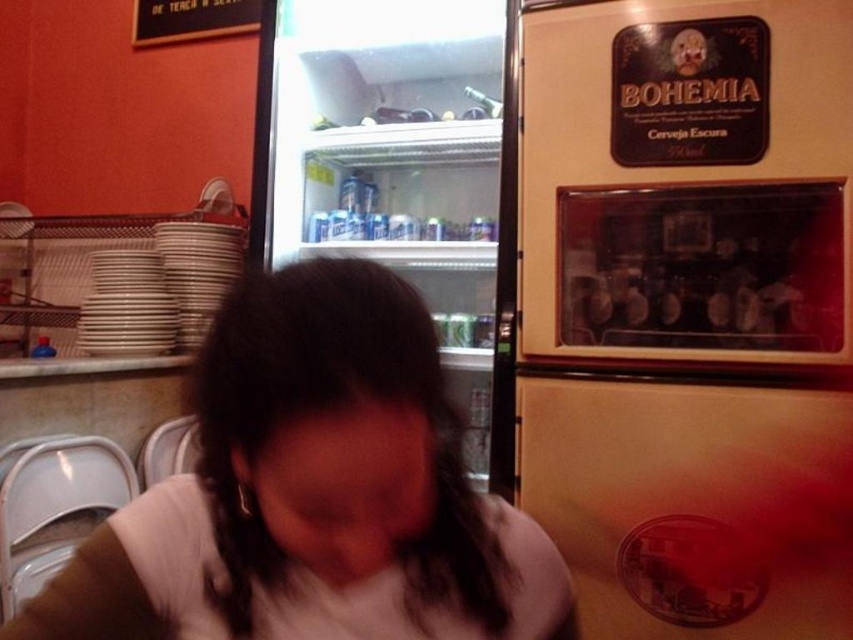
You are a customer in the eatery and want to ask the staff member wearing the white matte shirt at center about the drinks available. Where should you look to find them?

The white matte shirt at center is located at point (x=314, y=492), so you should look there to find the staff member.

You are standing at the entrance of the eatery and want to move towards the point at coordinates point (x=154, y=570). However, there is an obstacle at point (x=337, y=17). Based on the scene description, can you safely navigate around the obstacle to reach your destination?

Yes, you can safely navigate around the obstacle because point (x=154, y=570) is in front of point (x=337, y=17), meaning the destination is closer to you than the obstacle. This suggests the obstacle is behind the destination, so you can move forward towards the destination without encountering the obstacle first.